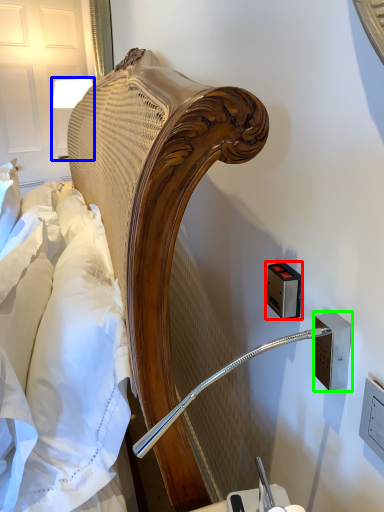
Question: Considering the real-world distances, which object is closest to electric outlet (highlighted by a red box)? bedside lamp (highlighted by a blue box) or electric outlet (highlighted by a green box).

Choices:
 (A) bedside lamp
 (B) electric outlet

Answer: (B)